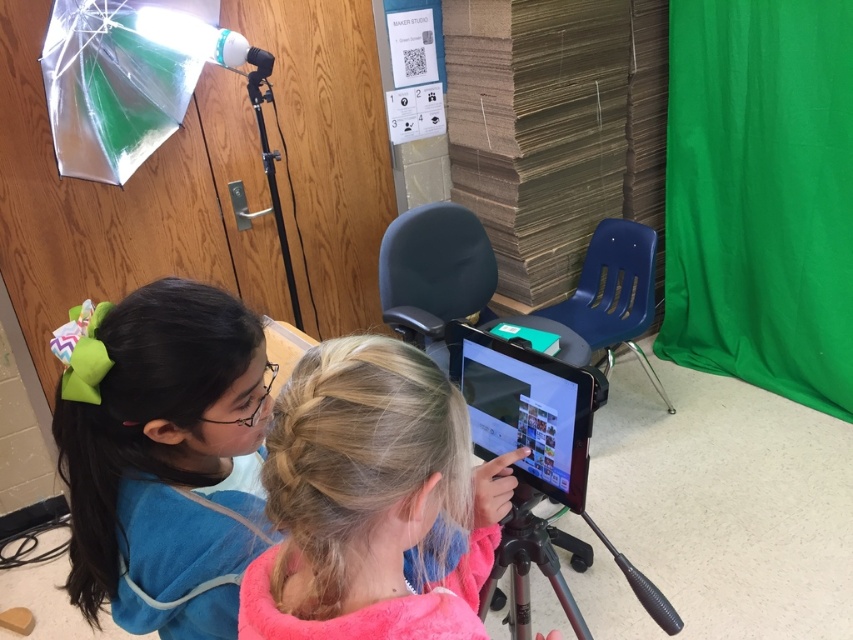
Who is higher up, transparent plastic umbrella at upper left or shiny black tablet at center?

transparent plastic umbrella at upper left is above.

Who is more forward, (64, 54) or (549, 497)?

Point (549, 497)

Find the location of a particular element. This screenshot has width=853, height=640. transparent plastic umbrella at upper left is located at coordinates (120, 77).

Does transparent plastic umbrella at upper left have a lesser width compared to matte black chair at center?

Yes.

Is transparent plastic umbrella at upper left to the left of matte black chair at center from the viewer's perspective?

Correct, you'll find transparent plastic umbrella at upper left to the left of matte black chair at center.

Does point (100, 0) come in front of point (387, 269)?

Yes, point (100, 0) is in front of point (387, 269).

At what (x,y) coordinates should I click in order to perform the action: click on transparent plastic umbrella at upper left. Please return your answer as a coordinate pair (x, y). Image resolution: width=853 pixels, height=640 pixels. Looking at the image, I should click on (120, 77).

Which is in front, point (415, 483) or point (566, 547)?

Point (415, 483) is in front.

Does pink fleece jacket at center come in front of metallic tripod at center?

That is True.

Identify the location of pink fleece jacket at center. (364, 499).